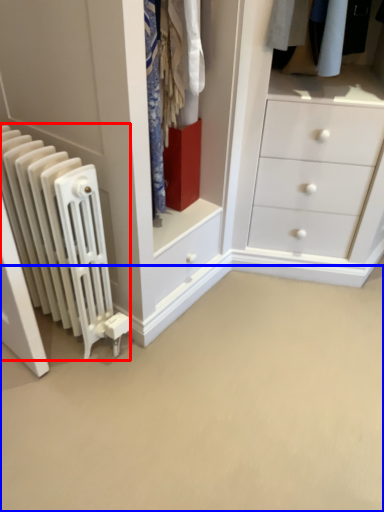
Question: Among these objects, which one is nearest to the camera, radiator (highlighted by a red box) or plain (highlighted by a blue box)?

Choices:
 (A) radiator
 (B) plain

Answer: (B)